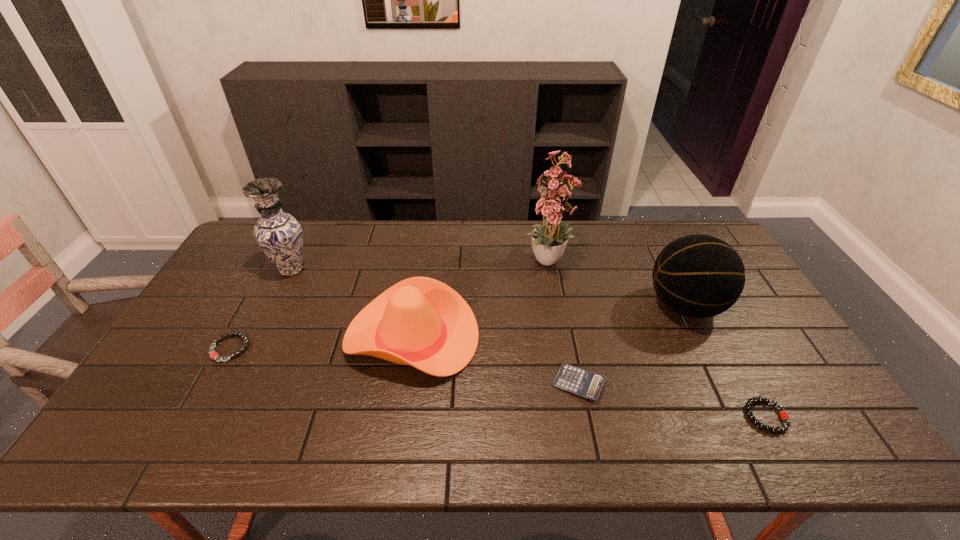
Where is `vacant area between the right bracelet and the third tallest object`? The height and width of the screenshot is (540, 960). vacant area between the right bracelet and the third tallest object is located at coordinates (726, 361).

Locate an element on the screen. The height and width of the screenshot is (540, 960). vacant space that's between the nearer bracelet and the second tallest object is located at coordinates (529, 343).

Identify the location of vacant space in between the flower arrangement and the fourth shortest object. (481, 300).

I want to click on vacant area between the calculator and the third object from left to right, so [x=495, y=360].

This screenshot has height=540, width=960. In order to click on free space that is in between the left bracelet and the calculator in this screenshot , I will do `click(404, 366)`.

At what (x,y) coordinates should I click in order to perform the action: click on vacant region between the farther bracelet and the cowboy hat. Please return your answer as a coordinate pair (x, y). This screenshot has height=540, width=960. Looking at the image, I should click on (x=321, y=342).

Image resolution: width=960 pixels, height=540 pixels. I want to click on vacant area that lies between the sixth shortest object and the cowboy hat, so click(351, 303).

You are a GUI agent. You are given a task and a screenshot of the screen. Output one action in this format:
    pyautogui.click(x=<x>, y=<y>)
    Task: Click on the free space that is in between the left bracelet and the second tallest object
    This screenshot has width=960, height=540.
    Given the screenshot: What is the action you would take?
    pyautogui.click(x=260, y=309)

Select which object appears as the fifth closest to the third tallest object. Please provide its 2D coordinates. Your answer should be formatted as a tuple, i.e. [(x, y)], where the tuple contains the x and y coordinates of a point satisfying the conditions above.

[(279, 234)]

Locate an element on the screen. The width and height of the screenshot is (960, 540). the fourth closest object to the fourth tallest object is located at coordinates (213, 355).